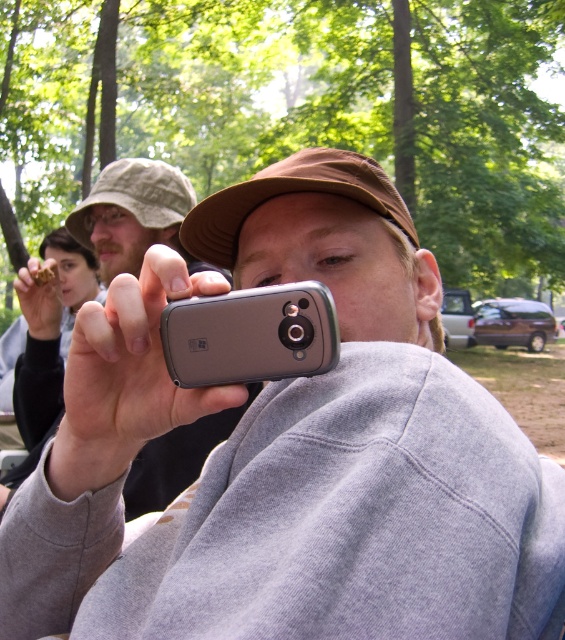
Can you confirm if silver metallic phone at center is positioned to the left of silver metallic smartphone at center?

Correct, you'll find silver metallic phone at center to the left of silver metallic smartphone at center.

Does silver metallic phone at center come behind silver metallic smartphone at center?

No, silver metallic phone at center is in front of silver metallic smartphone at center.

Is point (154, 198) positioned after point (275, 332)?

Yes.

I want to click on silver metallic phone at center, so click(134, 216).